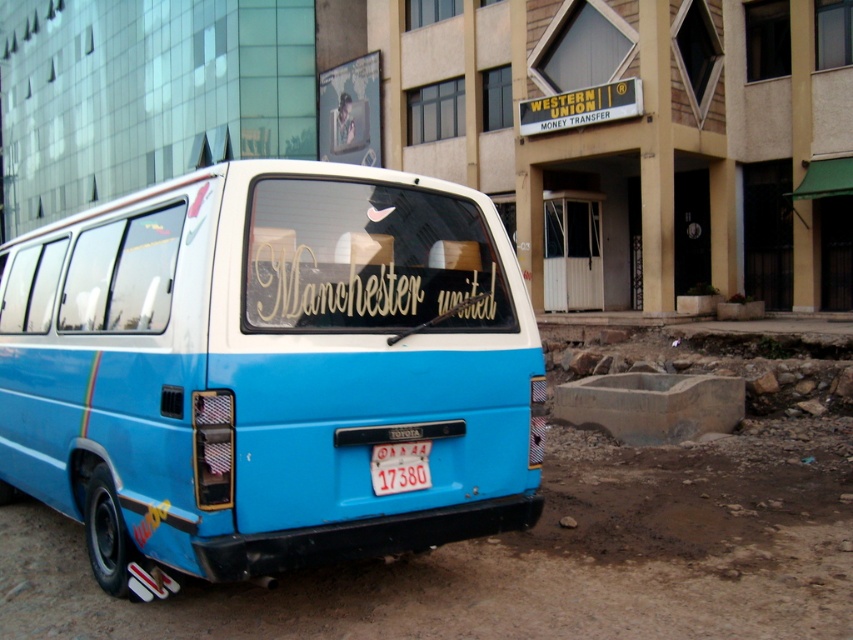
You are a delivery driver who needs to park your blue matte van at center in a parking spot that requires the vehicle to be shorter than the white plastic license plate at center. Can your van meet this requirement?

The blue matte van at center is taller than the white plastic license plate at center, so it cannot meet the requirement as it exceeds the height limit.